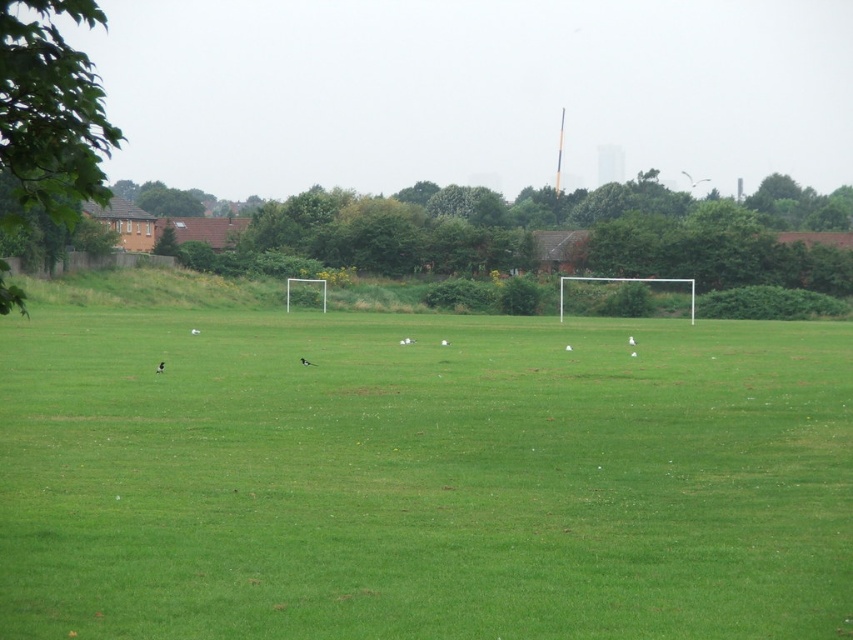
Question: Is green grass field at center below green leafy tree at center?

Choices:
 (A) yes
 (B) no

Answer: (A)

Question: Which point is closer to the camera?

Choices:
 (A) (624, 362)
 (B) (13, 148)
 (C) (619, 204)

Answer: (B)

Question: Is green grass field at center to the right of green leafy tree at left from the viewer's perspective?

Choices:
 (A) no
 (B) yes

Answer: (B)

Question: Which point is closer to the camera?

Choices:
 (A) green grass field at center
 (B) green leafy tree at left
 (C) green leafy tree at center

Answer: (B)

Question: Which of the following is the closest to the observer?

Choices:
 (A) (747, 428)
 (B) (61, 106)

Answer: (B)

Question: Considering the relative positions of green grass field at center and green leafy tree at left in the image provided, where is green grass field at center located with respect to green leafy tree at left?

Choices:
 (A) right
 (B) left

Answer: (A)